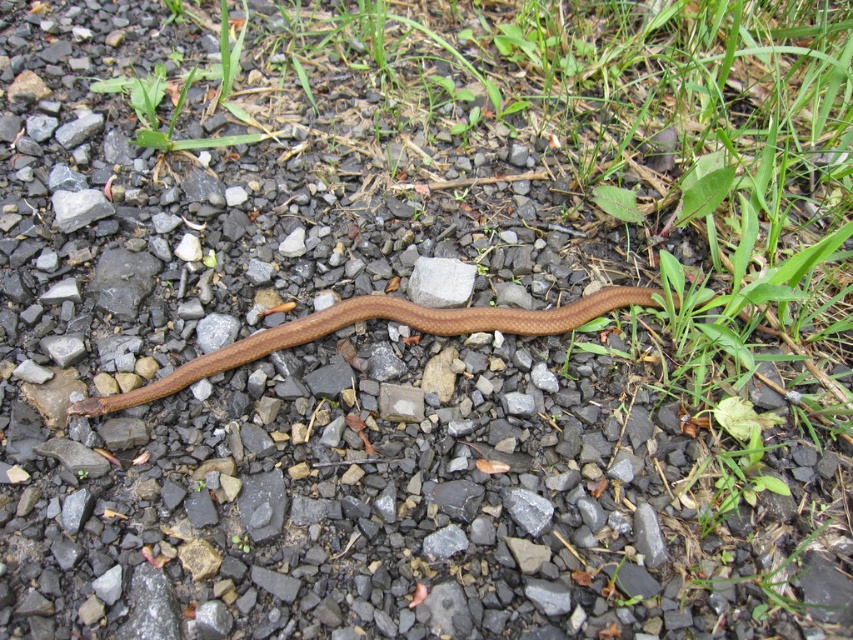
Who is more forward, (239, 346) or (425, 272)?

Point (239, 346) is more forward.

Can you confirm if brown matte snake at center is positioned above gray smooth rock at center?

Actually, brown matte snake at center is below gray smooth rock at center.

Is point (572, 308) farther from camera compared to point (434, 291)?

No, (572, 308) is closer to viewer.

Locate an element on the screen. brown matte snake at center is located at coordinates (374, 317).